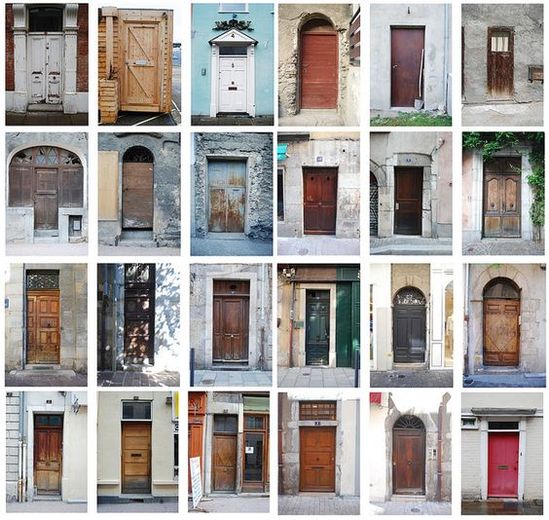
This screenshot has height=520, width=549. I want to click on painted doors, so click(x=313, y=325), click(x=402, y=325), click(x=509, y=446), click(x=229, y=85), click(x=44, y=56), click(x=231, y=186).